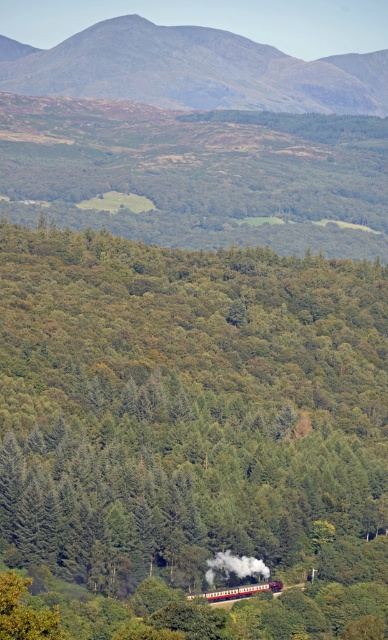
You are standing at the point marked with coordinates point (192, 70) in the image. What is the most prominent feature you can see in that location?

The point (192, 70) indicates a rugged brown mountain at upper center.

You are a passenger on the red polished wood passenger train at center. You look out the window and see the rugged brown mountain at upper center. Is the mountain closer to you or farther away than the train?

The rugged brown mountain at upper center is farther away than the red polished wood passenger train at center because the mountain is positioned further to the viewer than the train.